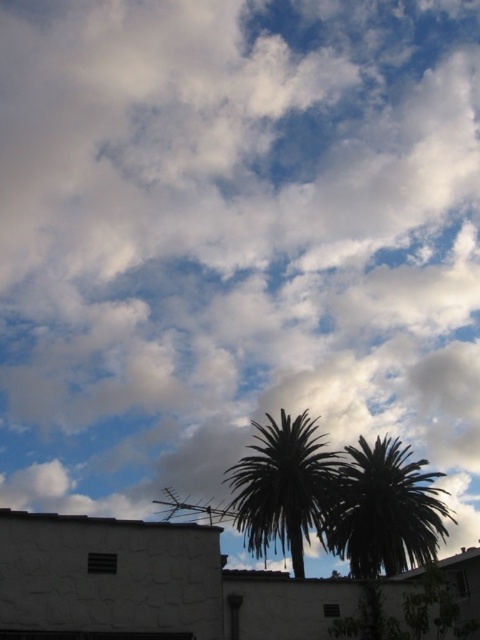
You are an architect designing a new garden area. You need to place a bench between the green leafy palm tree at center and the green leafy palm at center. Which palm should the bench be closer to to ensure it fits within the space?

The bench should be closer to the green leafy palm at center because the green leafy palm tree at center is wider, so placing the bench near the narrower palm allows more space for the bench.

You are standing in front of the building and want to take a photo of the green leafy palm tree at center. Where should you position yourself to ensure the tree is centered in your camera viewfinder?

To center the green leafy palm tree at center in your camera viewfinder, position yourself directly in front of the building at the point corresponding to its 2D location at coordinates approximately 0.797 on the x and 0.802 on the y axis.